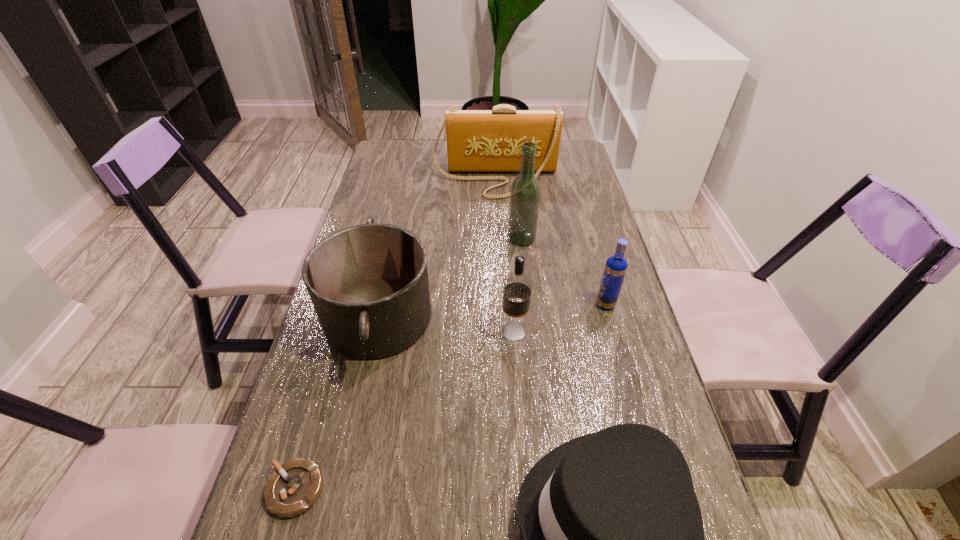
Identify the location of vacant region located 0.290m on the label of the nearer vodka. Image resolution: width=960 pixels, height=540 pixels. (382, 330).

What are the coordinates of `blank area located on the label of the nearer vodka` in the screenshot? It's located at (430, 330).

This screenshot has height=540, width=960. In order to click on vacant space located 0.350m on the front of the farther vodka in this screenshot , I will do `click(644, 442)`.

You are a GUI agent. You are given a task and a screenshot of the screen. Output one action in this format:
    pyautogui.click(x=<x>, y=<y>)
    Task: Click on the free space located on the front of the pan
    The image size is (960, 540).
    Given the screenshot: What is the action you would take?
    pyautogui.click(x=332, y=529)

Where is `vacant space located 0.250m on the right of the shortest object`? The height and width of the screenshot is (540, 960). vacant space located 0.250m on the right of the shortest object is located at coordinates (458, 489).

In order to click on object situated at the far edge in this screenshot , I will do `click(477, 140)`.

Find the location of a particular element. The width and height of the screenshot is (960, 540). pan located at the left edge is located at coordinates (369, 286).

Where is `ashtray that is positioned at the left edge`? The width and height of the screenshot is (960, 540). ashtray that is positioned at the left edge is located at coordinates (293, 488).

Locate an element on the screen. handbag at the right edge is located at coordinates (477, 140).

The width and height of the screenshot is (960, 540). I want to click on vodka that is positioned at the right edge, so click(x=615, y=269).